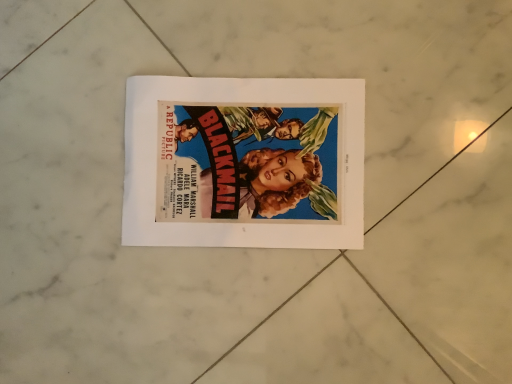
Identify the location of vacant space in front of matte paper poster at center. The height and width of the screenshot is (384, 512). (311, 314).